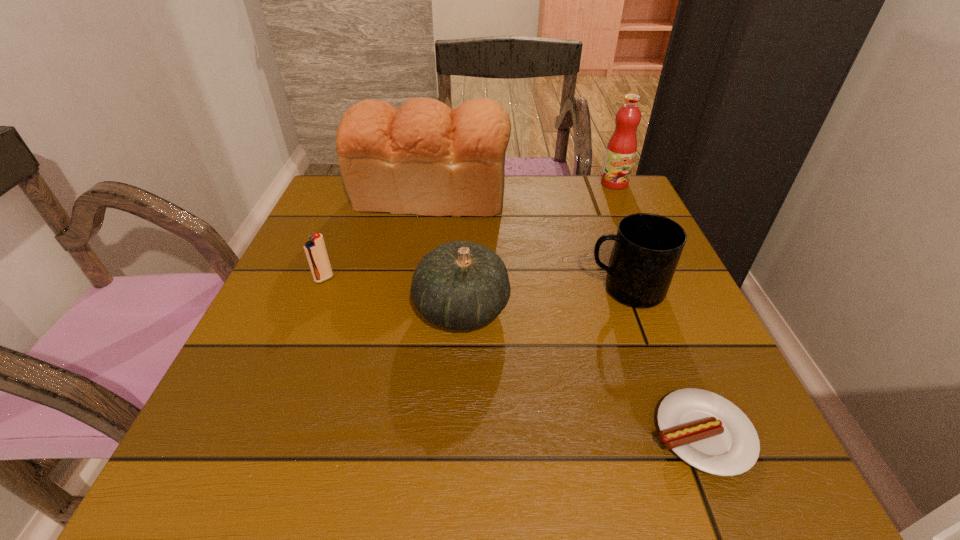
This screenshot has height=540, width=960. In order to click on free spot located 0.090m on the side of the mug with the handle in this screenshot , I will do `click(541, 289)`.

You are a GUI agent. You are given a task and a screenshot of the screen. Output one action in this format:
    pyautogui.click(x=<x>, y=<y>)
    Task: Click on the free space located on the side of the mug with the handle
    The image size is (960, 540).
    Given the screenshot: What is the action you would take?
    pyautogui.click(x=461, y=289)

The width and height of the screenshot is (960, 540). Identify the location of vacant area situated 0.390m on the side of the mug with the handle. (391, 289).

At what (x,y) coordinates should I click in order to perform the action: click on free spot located 0.130m on the back of the igniter. Please return your answer as a coordinate pair (x, y). The image size is (960, 540). Looking at the image, I should click on (341, 237).

Locate an element on the screen. The width and height of the screenshot is (960, 540). free space located on the left of the sausage is located at coordinates (481, 434).

You are a GUI agent. You are given a task and a screenshot of the screen. Output one action in this format:
    pyautogui.click(x=<x>, y=<y>)
    Task: Click on the bread that is at the far edge
    This screenshot has width=960, height=540.
    Given the screenshot: What is the action you would take?
    pyautogui.click(x=424, y=158)

Find the location of a particular element. Image resolution: width=960 pixels, height=540 pixels. fruit juice situated at the far edge is located at coordinates (621, 149).

The image size is (960, 540). I want to click on object that is positioned at the near edge, so click(710, 433).

Where is `bread that is at the left edge`? bread that is at the left edge is located at coordinates (424, 158).

The image size is (960, 540). I want to click on igniter that is at the left edge, so click(315, 249).